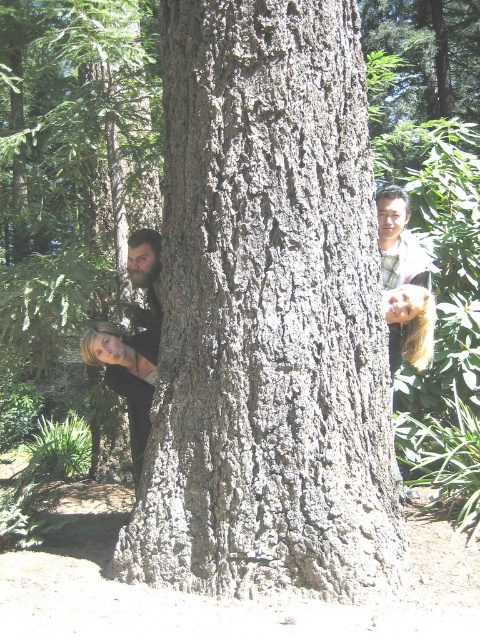
You are a photographer standing in a forest. You want to take a photo of the gray rough bark at center while also capturing the four people peeking out from behind it. The camera can focus on objects within 2 meters. Can you capture both the bark and the people clearly in the same photo?

The gray rough bark at center is 2.64 meters away from the camera, which is beyond the camera focus range of 2 meters. Therefore, the bark will be out of focus, and the people behind it will also be out of focus as they are at the same distance. The photo cannot capture both clearly.

You are a photographer trying to capture a candid shot of the bearded man at left and the smooth brown hair at center. Since they are partially hidden behind the tree trunk, which person do you need to move closer to the camera to get a clear view of their face?

The bearded man at left is positioned on the left side of smooth brown hair at center. To get a clear view of his face, you would need to move the bearded man at left closer to the camera so he is no longer blocked by the tree trunk.

You are standing in front of a large tree trunk in a forest. You notice two points marked on the tree trunk at coordinates point (247, 262) and point (425, 346). Which point is closer to your eyes?

Point (247, 262) is closer to the camera than point (425, 346), so the point closer to your eyes is point (247, 262).